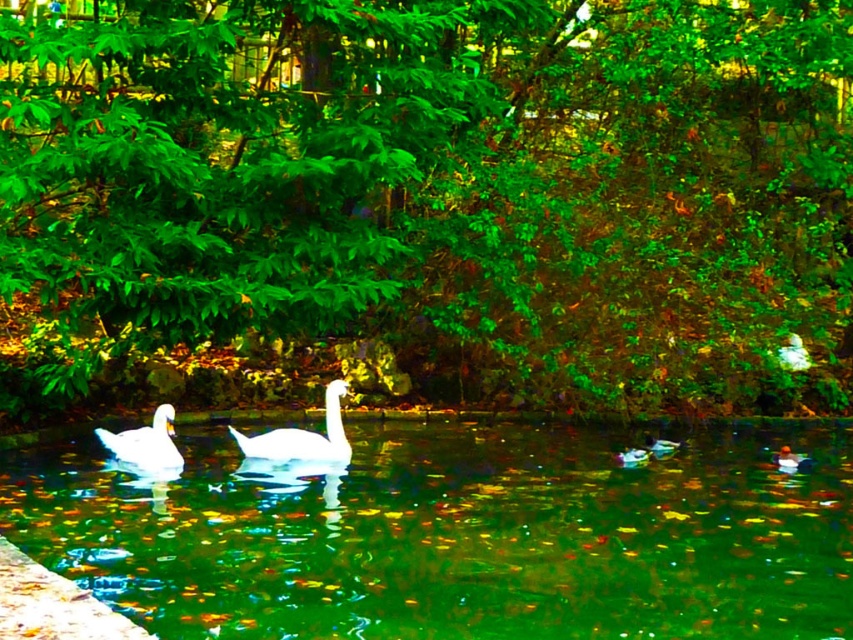
Does clear water at center appear over white glossy swan at center?

Incorrect, clear water at center is not positioned above white glossy swan at center.

Does point (250, 492) come farther from viewer compared to point (328, 426)?

No, it is not.

The width and height of the screenshot is (853, 640). I want to click on clear water at center, so click(x=456, y=534).

Is white glossy swan at center positioned behind white glossy swan at left?

Yes, white glossy swan at center is further from the viewer.

Can you confirm if white glossy swan at center is smaller than white glossy swan at left?

Incorrect, white glossy swan at center is not smaller in size than white glossy swan at left.

I want to click on white glossy swan at center, so click(302, 436).

Identify the location of white glossy swan at center. Image resolution: width=853 pixels, height=640 pixels. (302, 436).

Does green leafy tree at center lie behind clear water at center?

Yes, it is behind clear water at center.

Who is more distant from viewer, (x=126, y=227) or (x=700, y=481)?

Positioned behind is point (x=700, y=481).

The height and width of the screenshot is (640, 853). I want to click on green leafy tree at center, so click(x=437, y=189).